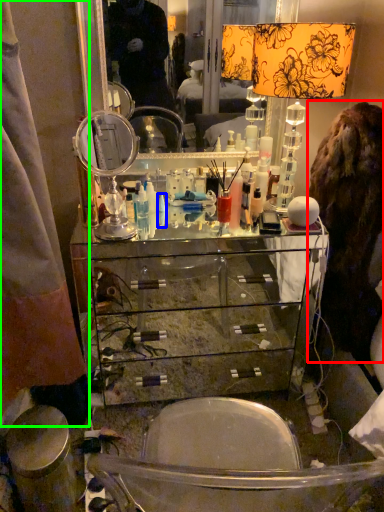
Question: Which object is the farthest from fur coat (highlighted by a red box)? Choose among these: toiletry (highlighted by a blue box) or curtain (highlighted by a green box).

Choices:
 (A) toiletry
 (B) curtain

Answer: (B)